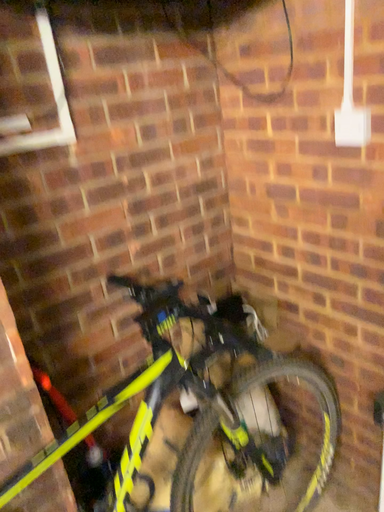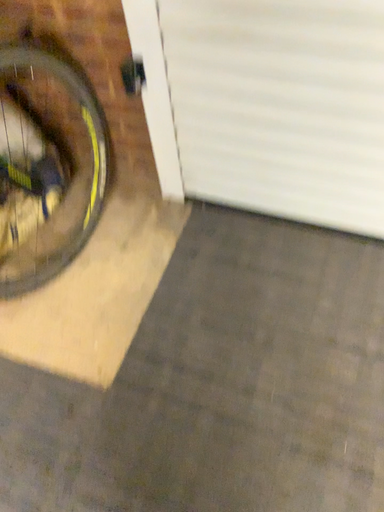
Question: How did the camera likely rotate when shooting the video?

Choices:
 (A) rotated upward
 (B) rotated downward

Answer: (B)